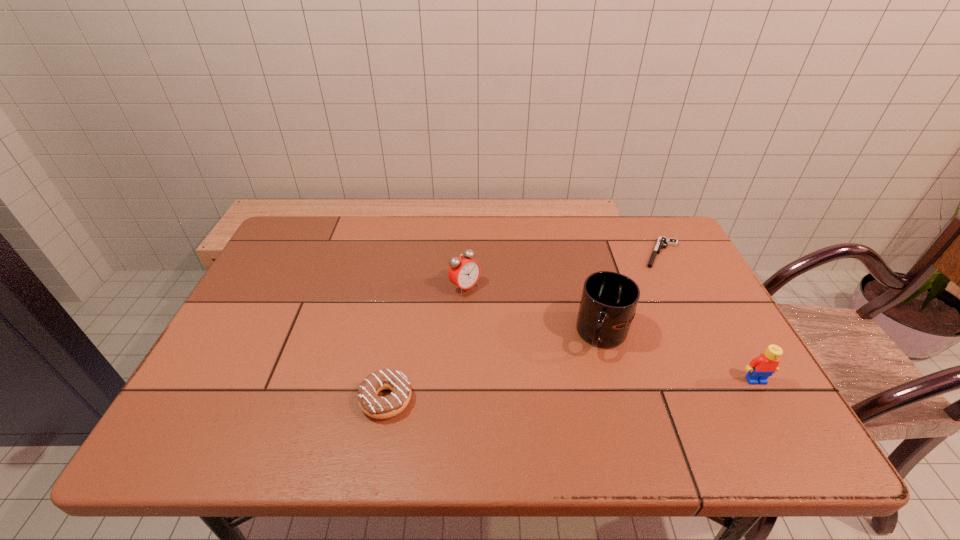
Locate an element on the screen. vacant space located on the front-facing side of the second farthest object is located at coordinates (488, 305).

Where is `free space located 0.080m on the front-facing side of the second farthest object`? Image resolution: width=960 pixels, height=540 pixels. free space located 0.080m on the front-facing side of the second farthest object is located at coordinates (496, 310).

Where is `vacant space situated 0.210m on the front-facing side of the second farthest object`? This screenshot has width=960, height=540. vacant space situated 0.210m on the front-facing side of the second farthest object is located at coordinates (533, 339).

Identify the location of vacant space located 0.100m with the handle on the side of the tallest object. (569, 382).

Locate an element on the screen. This screenshot has width=960, height=540. vacant region located 0.070m with the handle on the side of the tallest object is located at coordinates (576, 373).

What are the coordinates of `free point located 0.110m with the handle on the side of the tallest object` in the screenshot? It's located at (566, 384).

Identify the location of vacant region located 0.060m on the front-facing side of the pistol. (655, 279).

You are a GUI agent. You are given a task and a screenshot of the screen. Output one action in this format:
    pyautogui.click(x=<x>, y=<y>)
    Task: Click on the vacant region located on the front-facing side of the pistol
    
    Given the screenshot: What is the action you would take?
    pyautogui.click(x=636, y=330)

This screenshot has height=540, width=960. What are the coordinates of `vacant region located on the front-facing side of the pistol` in the screenshot? It's located at (650, 292).

The height and width of the screenshot is (540, 960). What are the coordinates of `object that is at the far edge` in the screenshot? It's located at (662, 242).